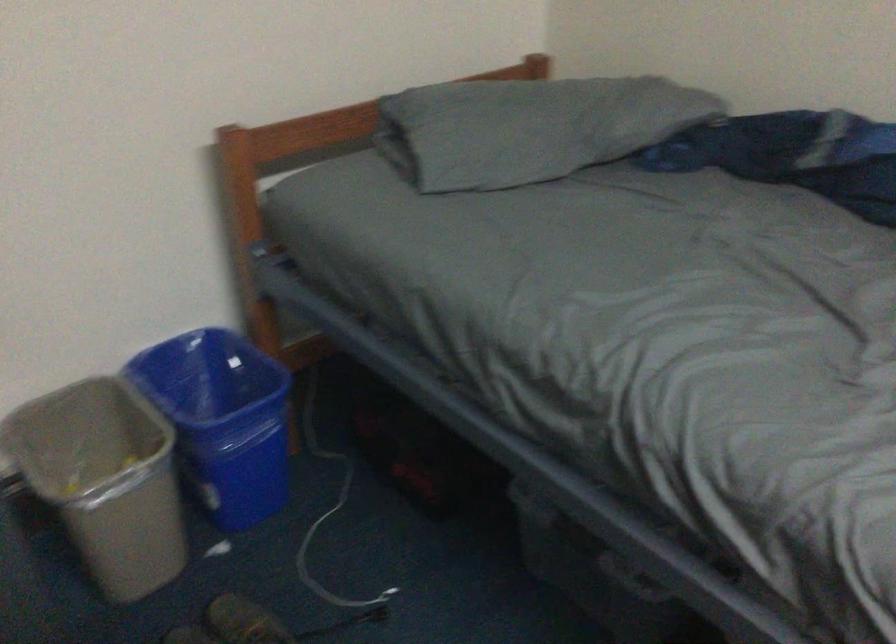
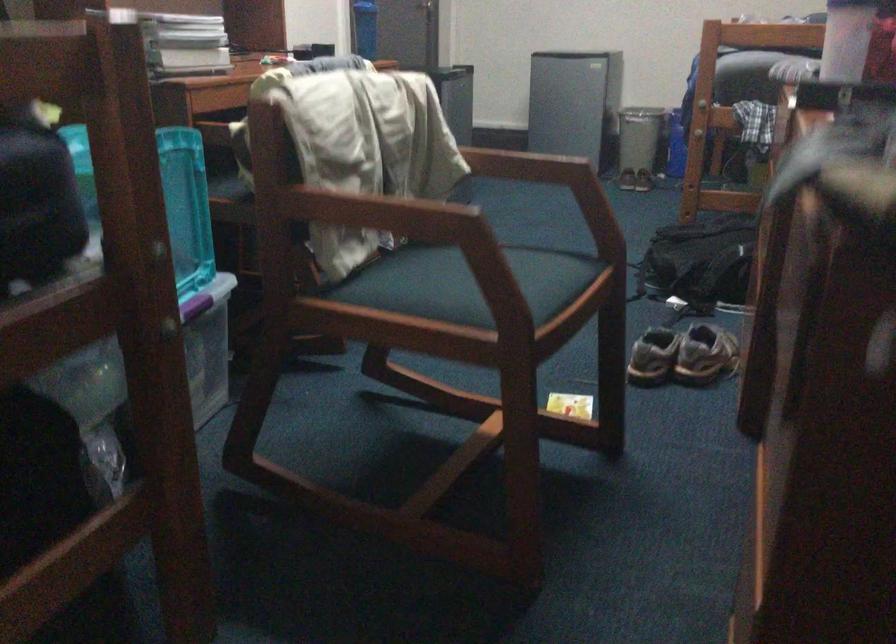
Question: I am providing you with two images of the same scene from different viewpoints. After the viewpoint changes to image2, which objects are now occluded?

Choices:
 (A) chair sitting surface
 (B) white electrical cable
 (C) pair of brown shoes
 (D) red folded cloth

Answer: (B)